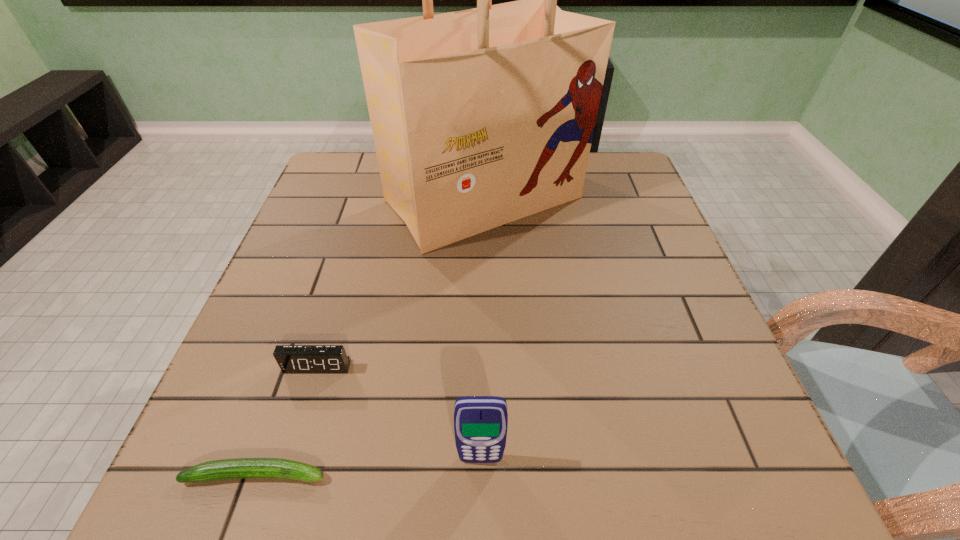
What are the coordinates of `free spot between the cellular telephone and the grocery bag` in the screenshot? It's located at (482, 329).

The height and width of the screenshot is (540, 960). I want to click on the closest object to the shortest object, so click(291, 358).

Choose which object is the nearest neighbor to the zucchini. Please provide its 2D coordinates. Your answer should be formatted as a tuple, i.e. [(x, y)], where the tuple contains the x and y coordinates of a point satisfying the conditions above.

[(291, 358)]

Locate an element on the screen. blank area in the image that satisfies the following two spatial constraints: 1. on the front-facing side of the third shortest object; 2. on the front-facing side of the zucchini is located at coordinates (481, 474).

The height and width of the screenshot is (540, 960). In order to click on vacant point that satisfies the following two spatial constraints: 1. on the front-facing side of the second tallest object; 2. on the front-facing side of the zucchini in this screenshot , I will do `click(481, 474)`.

I want to click on vacant space that satisfies the following two spatial constraints: 1. on the front-facing side of the second shortest object; 2. on the front-facing side of the shortest object, so click(284, 474).

Find the location of `free space that satisfies the following two spatial constraints: 1. on the side of the grocery bag with the superhero design; 2. on the front-facing side of the shortest object`. free space that satisfies the following two spatial constraints: 1. on the side of the grocery bag with the superhero design; 2. on the front-facing side of the shortest object is located at coordinates (487, 474).

Where is `vacant space that satisfies the following two spatial constraints: 1. on the side of the farthest object with the superhero design; 2. on the front-facing side of the shortest object`? vacant space that satisfies the following two spatial constraints: 1. on the side of the farthest object with the superhero design; 2. on the front-facing side of the shortest object is located at coordinates (487, 474).